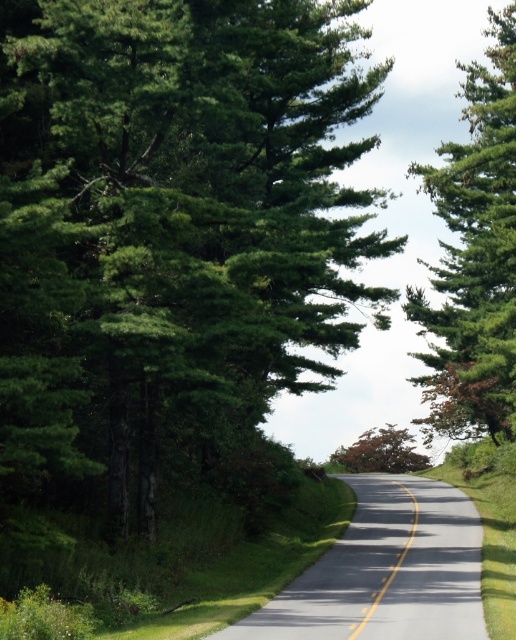
Based on the photo, you are driving a car and see two points on the road ahead. The first point is at coordinates point (68, 468) and the second is at point (459, 305). Which point is closer to your current position?

Point (68, 468) is in front of point (459, 305), so the first point is closer to your current position.

Based on the photo, you are a driver approaching the rural road scene. You notice the green matte tree at left and the yellow solid line at center. Which object would appear closer to you as you drive forward?

The green matte tree at left appears closer because it is larger in size than the yellow solid line at center, indicating it is nearer to the observer.